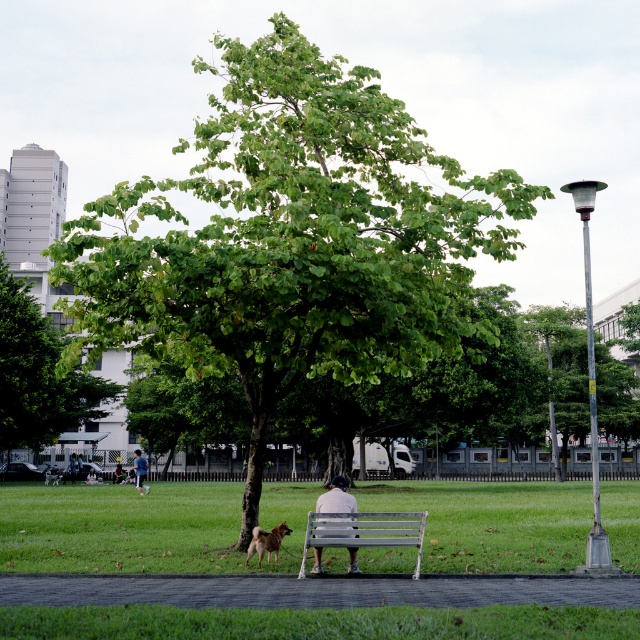
Does green leafy tree at center have a greater width compared to silver metallic bench at center?

Yes, green leafy tree at center is wider than silver metallic bench at center.

Is green leafy tree at center to the left of silver metallic bench at center from the viewer's perspective?

Indeed, green leafy tree at center is positioned on the left side of silver metallic bench at center.

Measure the distance between point (234, 305) and camera.

16.87 meters

Where is `green leafy tree at center`? The width and height of the screenshot is (640, 640). green leafy tree at center is located at coordinates (292, 236).

Is green leafy tree at left positioned in front of brown fur dog at center?

That is False.

Can you confirm if green leafy tree at left is positioned to the right of brown fur dog at center?

No, green leafy tree at left is not to the right of brown fur dog at center.

This screenshot has height=640, width=640. Identify the location of green leafy tree at left. (36, 372).

Image resolution: width=640 pixels, height=640 pixels. I want to click on green leafy tree at left, so click(36, 372).

Is light beige fabric bench at center to the right of dark blue jeans at center from the viewer's perspective?

Indeed, light beige fabric bench at center is positioned on the right side of dark blue jeans at center.

Is point (321, 512) positioned before point (144, 467)?

Yes, it is in front of point (144, 467).

Does point (336, 486) lie in front of point (138, 452)?

Yes, point (336, 486) is closer to viewer.

Locate an element on the screen. This screenshot has width=640, height=640. light beige fabric bench at center is located at coordinates (337, 497).